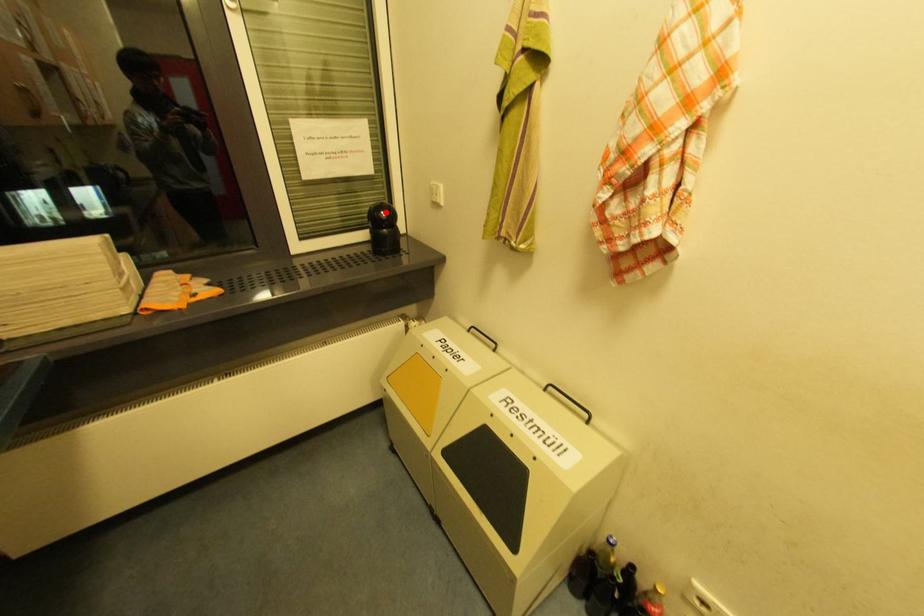
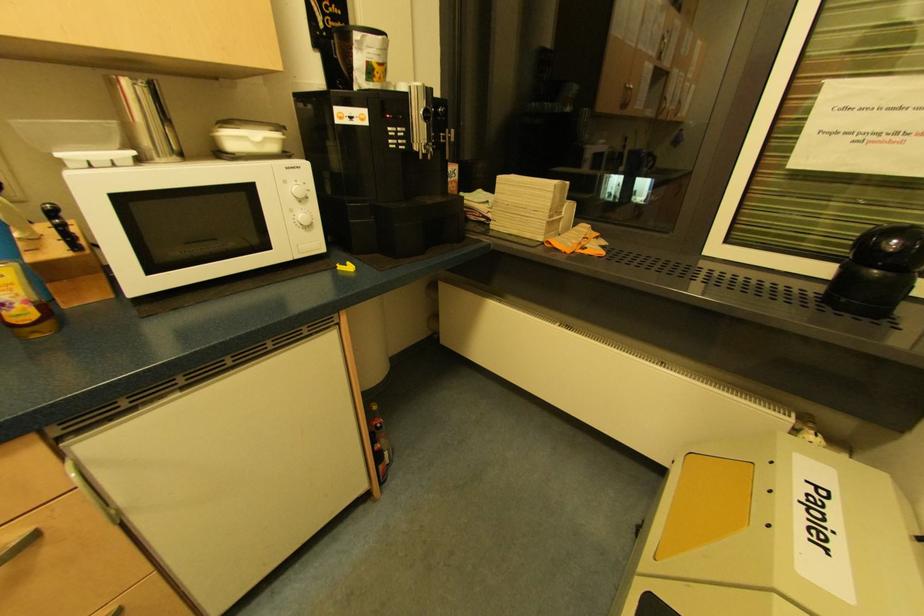
The point at the highlighted location is marked in the first image. Where is the corresponding point in the second image?

(897, 241)